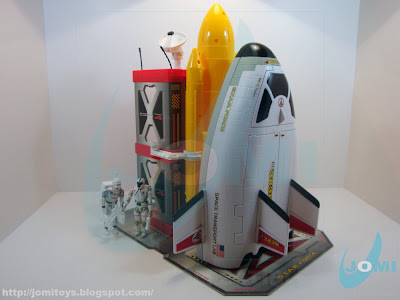
I want to click on white wall, so click(23, 128), click(118, 76), click(372, 112).